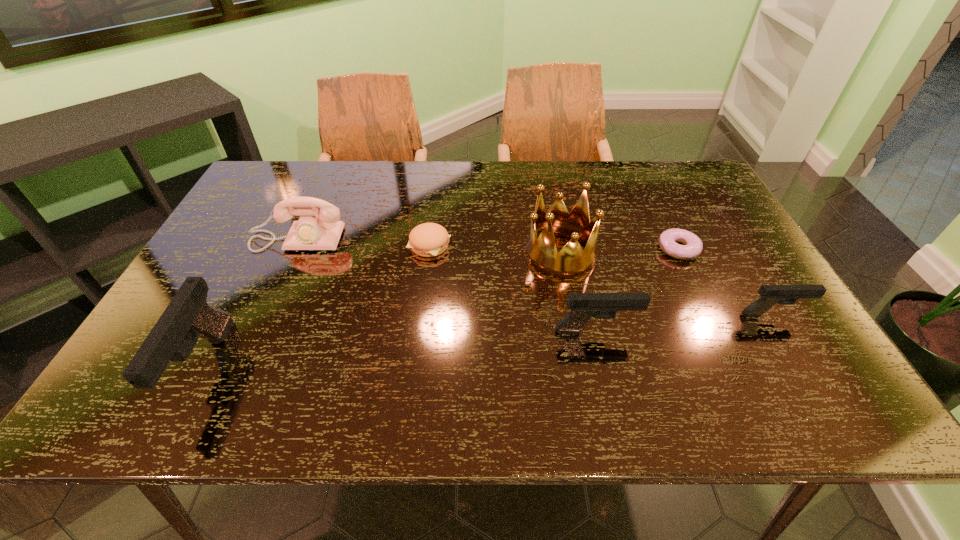
The image size is (960, 540). I want to click on doughnut present at the right edge, so click(x=693, y=246).

Locate an element on the screen. Image resolution: width=960 pixels, height=540 pixels. object at the near left corner is located at coordinates (188, 316).

The image size is (960, 540). In the image, there is a desktop. Find the location of `vacant region at the far edge`. vacant region at the far edge is located at coordinates 475,195.

You are a GUI agent. You are given a task and a screenshot of the screen. Output one action in this format:
    pyautogui.click(x=<x>, y=<y>)
    Task: Click on the free space at the near edge of the desktop
    This screenshot has height=540, width=960.
    Given the screenshot: What is the action you would take?
    pyautogui.click(x=405, y=369)

The width and height of the screenshot is (960, 540). Find the location of `vacant space at the left edge`. vacant space at the left edge is located at coordinates (228, 302).

In the image, there is a desktop. Find the location of `vacant area at the far right corner`. vacant area at the far right corner is located at coordinates tap(687, 175).

The height and width of the screenshot is (540, 960). I want to click on vacant space at the near right corner of the desktop, so click(798, 343).

Find the location of a particular element. This screenshot has width=960, height=540. vacant region between the fourth tallest object and the shortest object is located at coordinates (637, 290).

The image size is (960, 540). Identify the location of vacant space that is in between the second tallest pistol and the leftmost pistol. (400, 349).

What are the coordinates of `free spot between the sixth object from left to right and the second shortest pistol` in the screenshot? It's located at (637, 290).